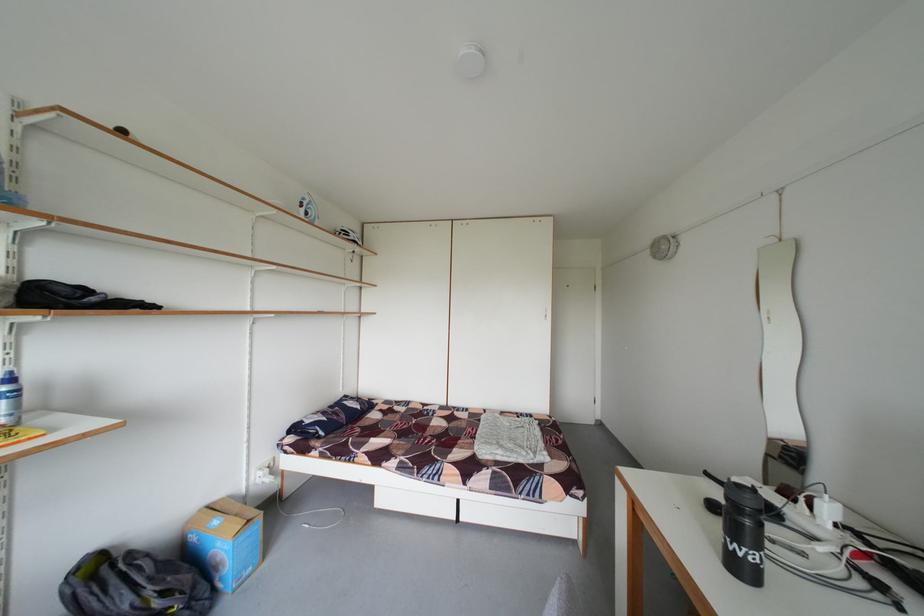
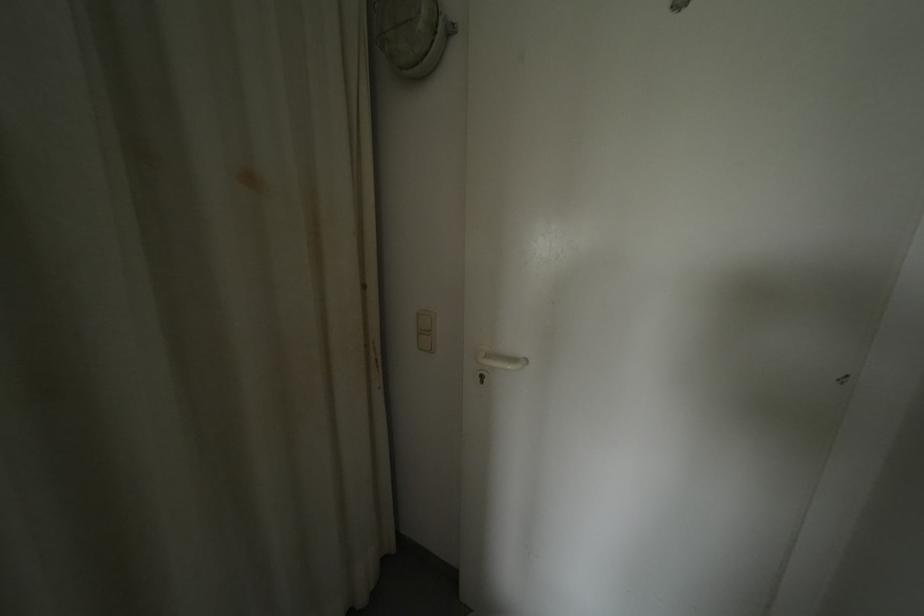
Based on the photo, which direction would the cameraman need to move to produce the second image?

The movement direction of the cameraman is right, forward.